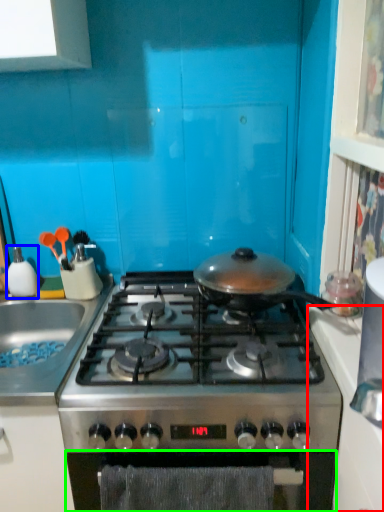
Question: Based on their relative distances, which object is nearer to counter top (highlighted by a red box)? Choose from kitchen appliance (highlighted by a blue box) and oven (highlighted by a green box).

Choices:
 (A) kitchen appliance
 (B) oven

Answer: (B)